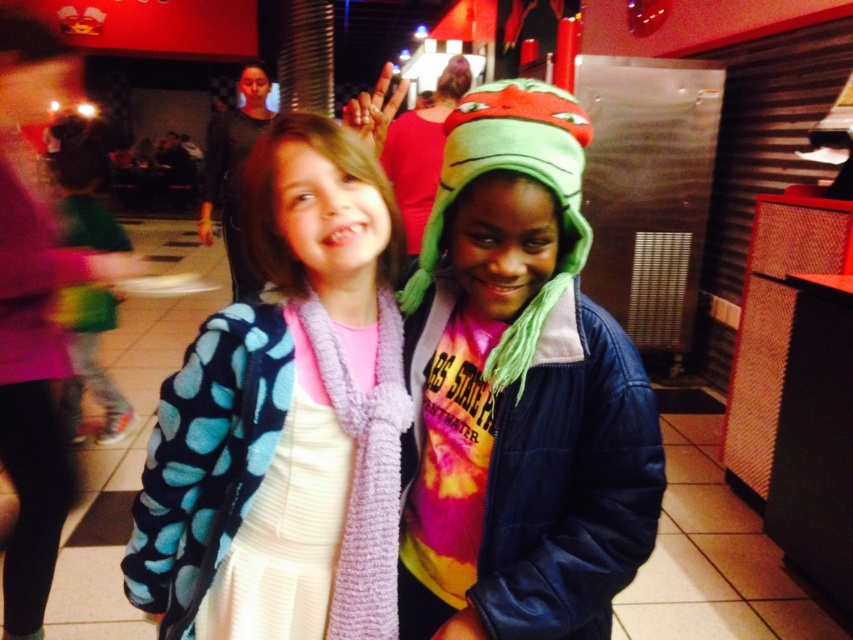
Looking at this image, which is below, green plush hat at center or blue polka dot fleece jacket at center?

blue polka dot fleece jacket at center

Is point (564, 454) farther from viewer compared to point (352, 225)?

That is True.

Does point (502, 417) come farther from viewer compared to point (308, 390)?

Yes, it is.

At what (x,y) coordinates should I click in order to perform the action: click on green plush hat at center. Please return your answer as a coordinate pair (x, y). The height and width of the screenshot is (640, 853). Looking at the image, I should click on (519, 390).